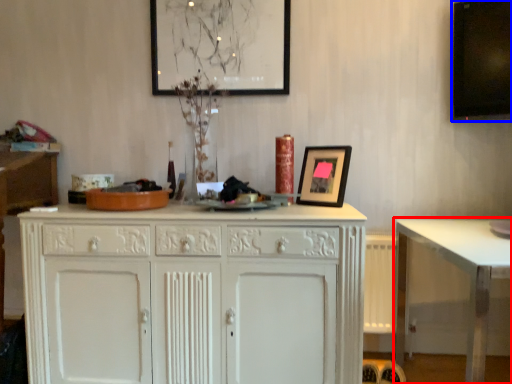
Question: Which point is closer to the camera, table (highlighted by a red box) or computer monitor (highlighted by a blue box)?

Choices:
 (A) table
 (B) computer monitor

Answer: (A)